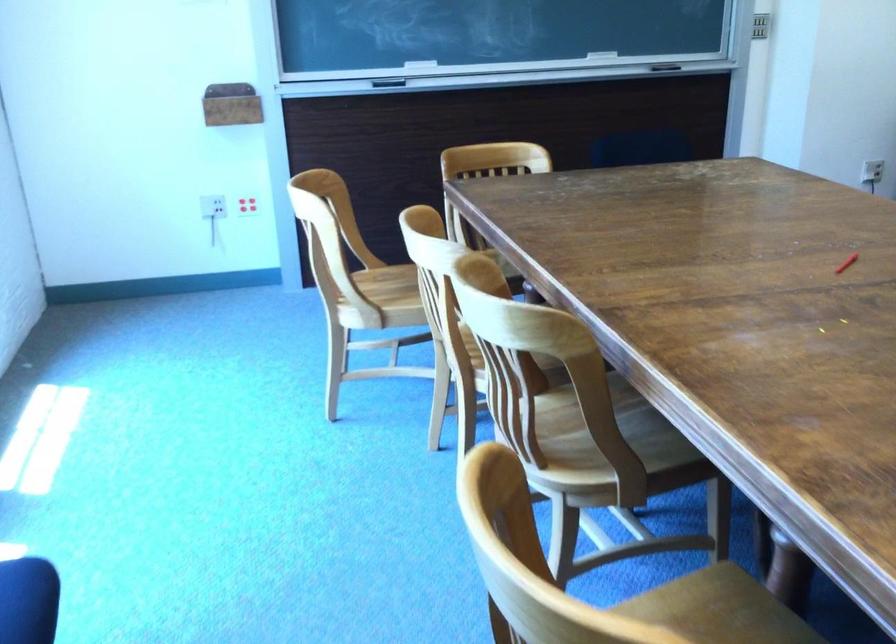
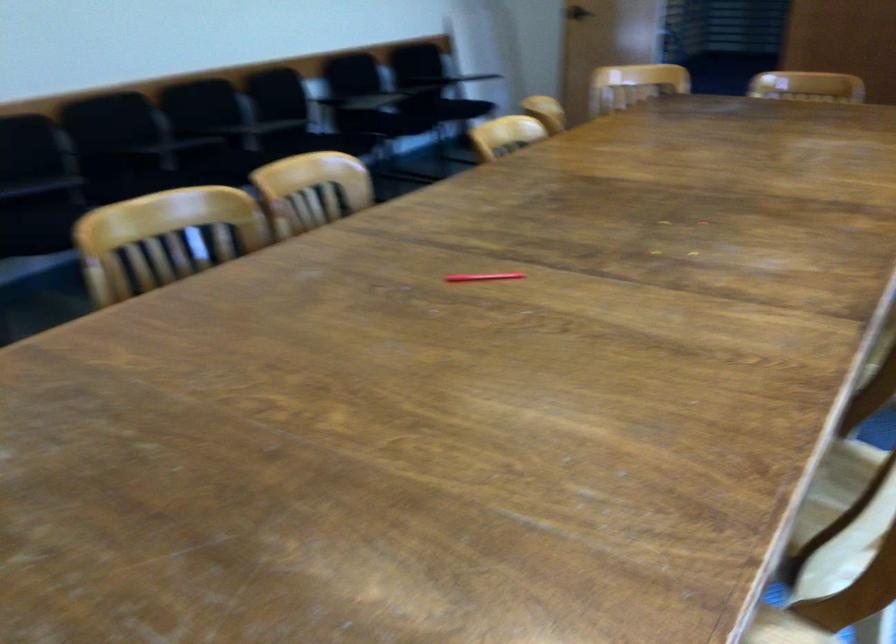
Question: I am providing you with two images of the same scene from different viewpoints. After the viewpoint changes to image2, which objects are now occluded?

Choices:
 (A) crystal ball
 (B) black chair sitting surface
 (C) light wood chair armrest
 (D) red pen

Answer: (C)